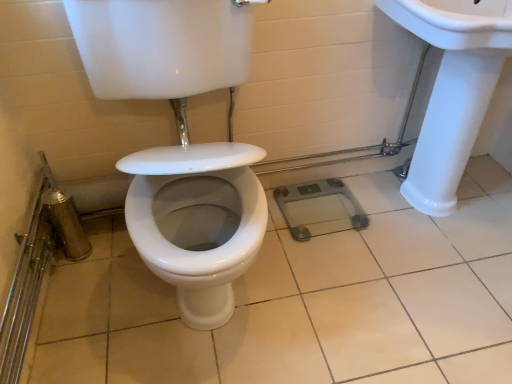
Question: Is point (474, 291) positioned closer to the camera than point (423, 153)?

Choices:
 (A) closer
 (B) farther

Answer: (A)

Question: Looking at the image, does white glossy tile at center seem bigger or smaller compared to white glossy sink at upper right?

Choices:
 (A) big
 (B) small

Answer: (B)

Question: Looking at their shapes, would you say white glossy tile at center is wider or thinner than white glossy sink at upper right?

Choices:
 (A) wide
 (B) thin

Answer: (A)

Question: From the image's perspective, is white glossy sink at upper right positioned above or below white glossy tile at center?

Choices:
 (A) below
 (B) above

Answer: (B)

Question: From a real-world perspective, is white glossy sink at upper right physically located above or below white glossy tile at center?

Choices:
 (A) below
 (B) above

Answer: (B)

Question: Is white glossy sink at upper right situated inside white glossy tile at center or outside?

Choices:
 (A) inside
 (B) outside

Answer: (B)

Question: Considering the positions of white glossy sink at upper right and white glossy tile at center in the image, is white glossy sink at upper right bigger or smaller than white glossy tile at center?

Choices:
 (A) small
 (B) big

Answer: (B)